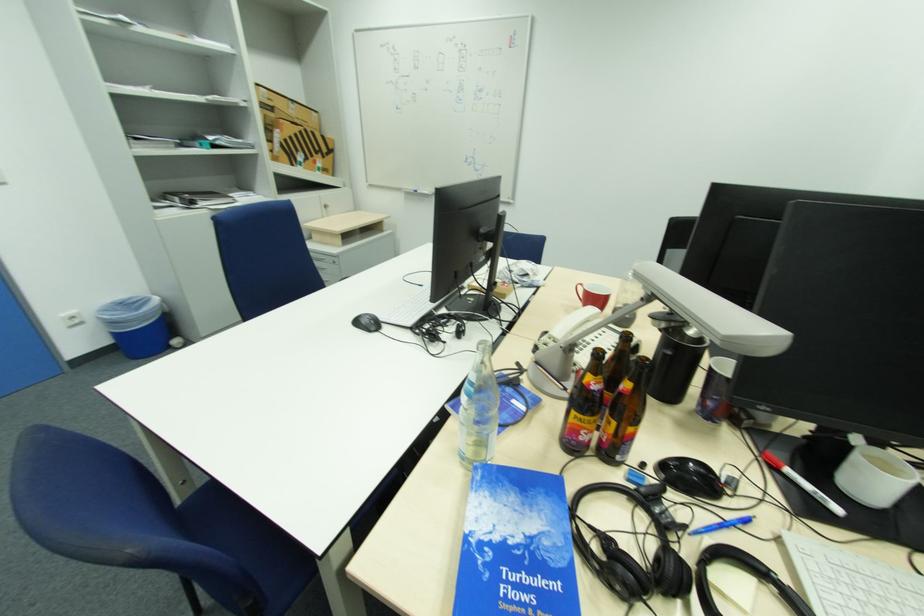
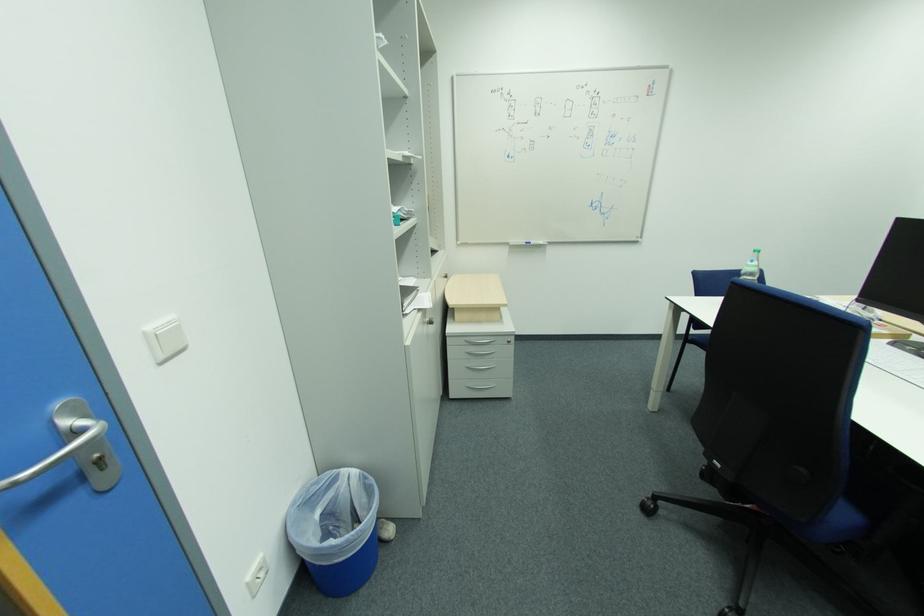
In the second image, find the point that corresponds to [432,193] in the first image.

(546, 244)